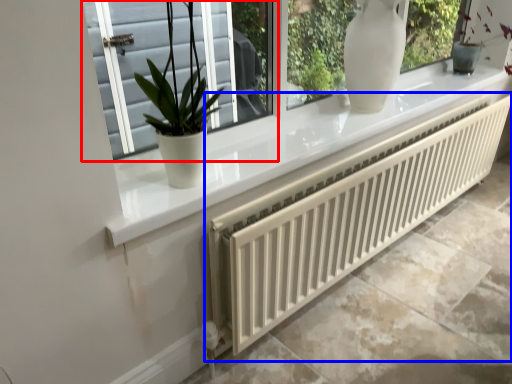
Question: Which of the following is the farthest to the observer, window (highlighted by a red box) or radiator (highlighted by a blue box)?

Choices:
 (A) window
 (B) radiator

Answer: (B)